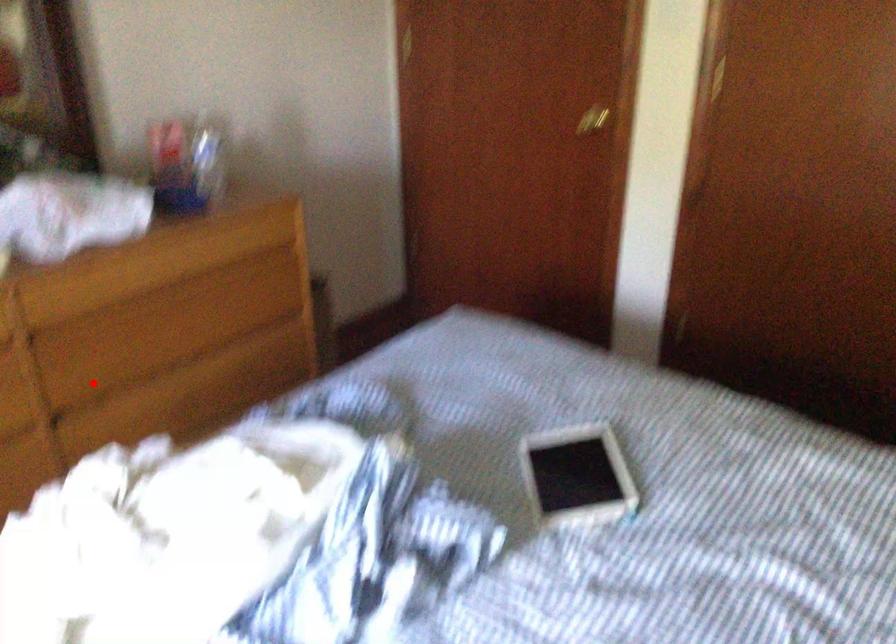
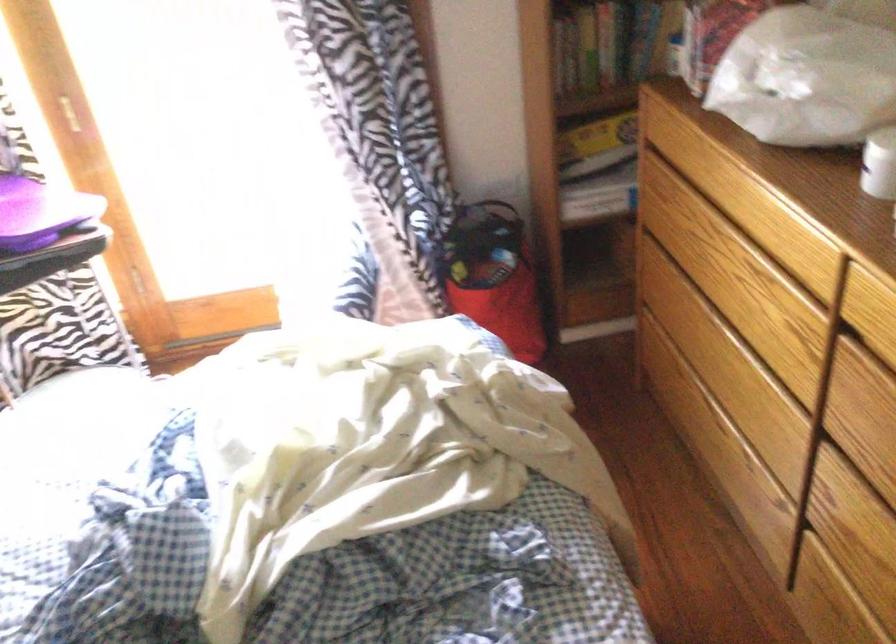
Question: I am providing you with two images of the same scene from different viewpoints. Image1 has a red point marked. In image2, the corresponding 3D location appears at what relative position? Reply with the corresponding letter.

Choices:
 (A) Closer
 (B) Farther

Answer: (A)